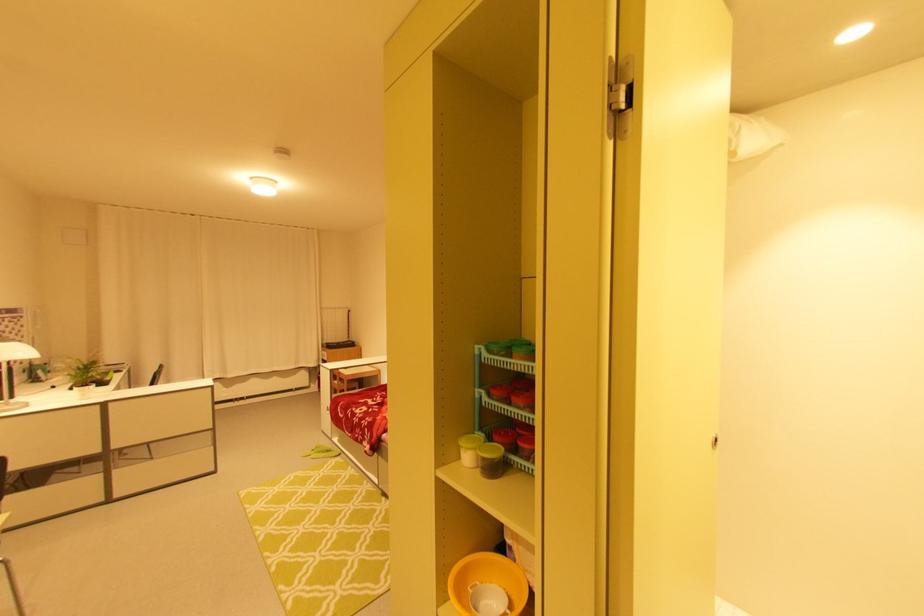
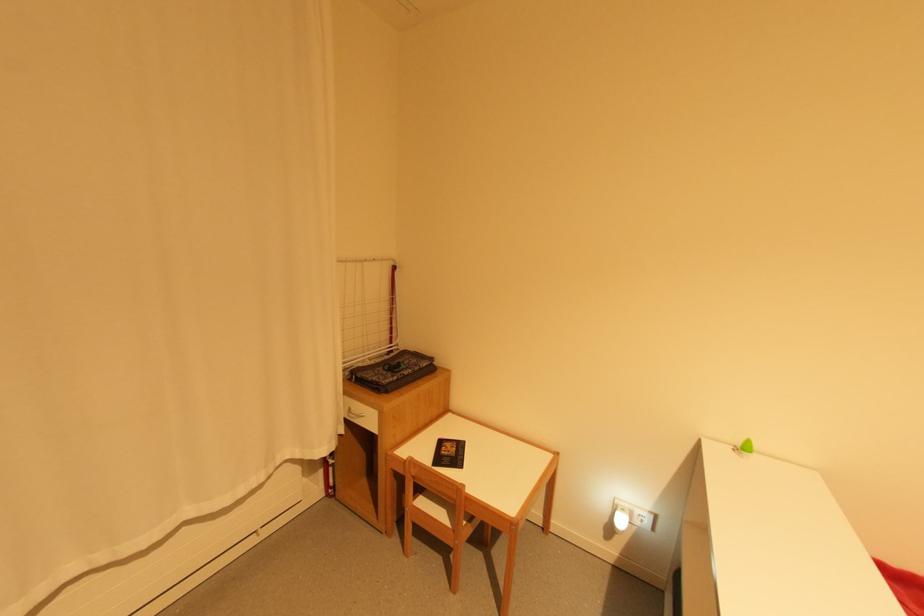
Locate, in the second image, the point that corresponds to the point at 350,344 in the first image.

(421, 369)